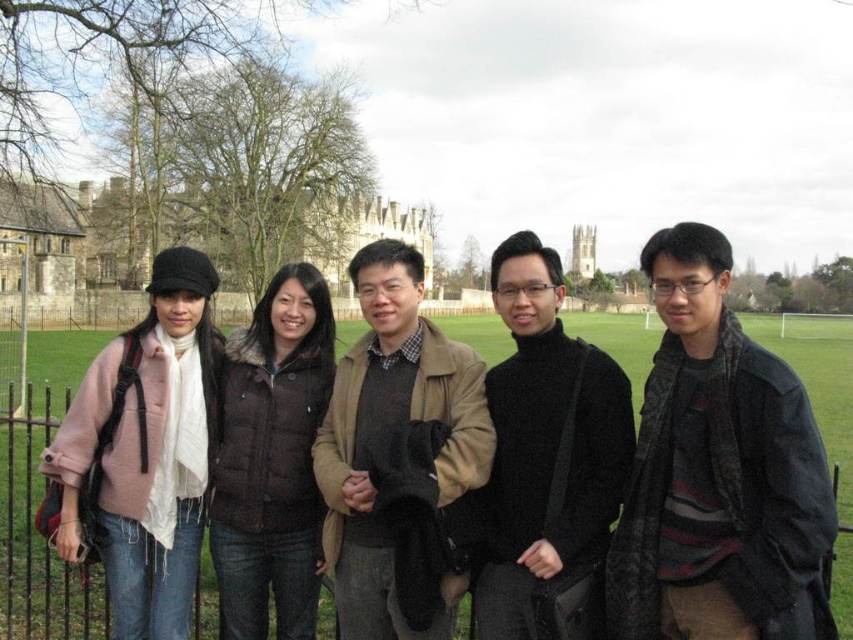
Can you confirm if black wool sweater at center is bigger than matte brown coat at center?

Correct, black wool sweater at center is larger in size than matte brown coat at center.

The image size is (853, 640). What do you see at coordinates (547, 460) in the screenshot?
I see `black wool sweater at center` at bounding box center [547, 460].

This screenshot has width=853, height=640. In order to click on black wool sweater at center in this screenshot , I will do `click(547, 460)`.

Find the location of a particular element. The height and width of the screenshot is (640, 853). black wool sweater at center is located at coordinates 547,460.

Who is higher up, dark gray wool scarf at right or black wool sweater at center?

black wool sweater at center is higher up.

Can you confirm if dark gray wool scarf at right is positioned to the left of black wool sweater at center?

No, dark gray wool scarf at right is not to the left of black wool sweater at center.

Is point (824, 508) positioned in front of point (589, 483)?

That is True.

The image size is (853, 640). In order to click on dark gray wool scarf at right in this screenshot , I will do `click(718, 474)`.

I want to click on matte brown coat at center, so click(390, 432).

Which is behind, point (408, 288) or point (33, 547)?

The point (408, 288) is more distant.

Identify the location of matte brown coat at center. This screenshot has height=640, width=853. (390, 432).